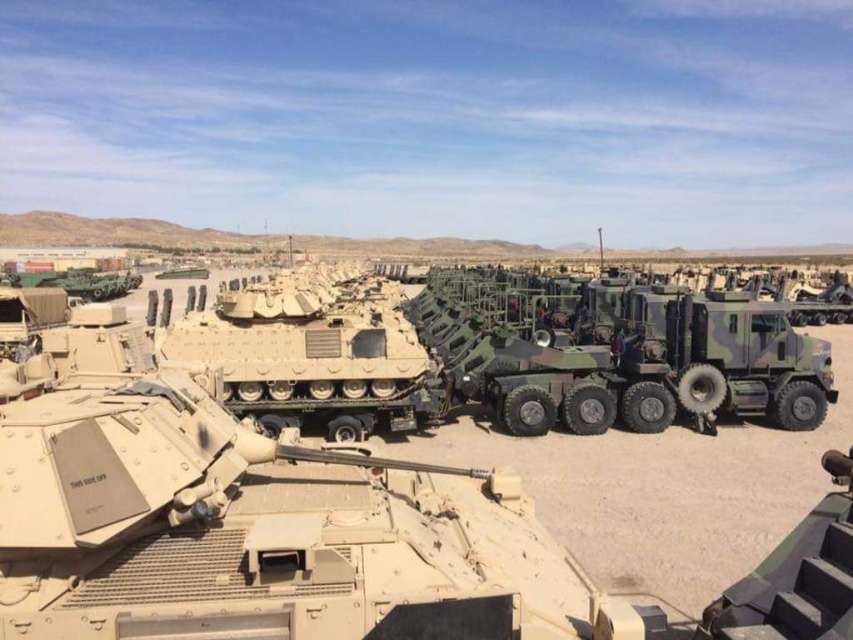
You are a military engineer assessing the height of the vehicles in the image. Which vehicle is shorter between the tan matte tank at center and the camouflage textured tank at center?

The tan matte tank at center is not as tall as the camouflage textured tank at center, so the tan matte tank at center is shorter.

You are a military engineer tasked with placing two markers on the ground at the coordinates given. The first marker is at point (383, 547) and the second at point (318, 305). Based on the scene description, which marker is closer to the armored vehicle in the foreground?

Point (383, 547) is closer to the armored vehicle in the foreground because it is in front of point (318, 305).

Consider the image. You are a military engineer inspecting the desert installation. You notice two tanks at the center of the scene. Which one is closer to you, the tan matte tank at center or the camouflage textured tank at center?

The tan matte tank at center is closer to you since it is positioned in front of the camouflage textured tank at center.